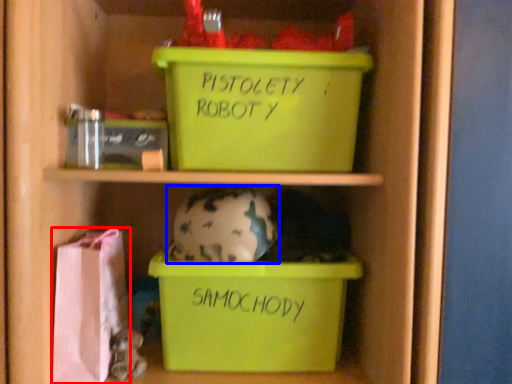
Question: Among these objects, which one is farthest to the camera, material (highlighted by a red box) or piggy bank (highlighted by a blue box)?

Choices:
 (A) material
 (B) piggy bank

Answer: (B)